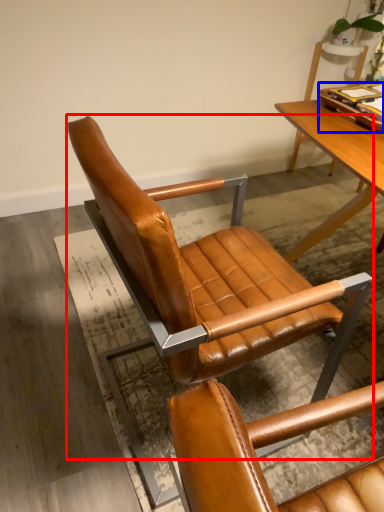
Question: Which of the following is the farthest to the observer, chair (highlighted by a red box) or tray (highlighted by a blue box)?

Choices:
 (A) chair
 (B) tray

Answer: (B)